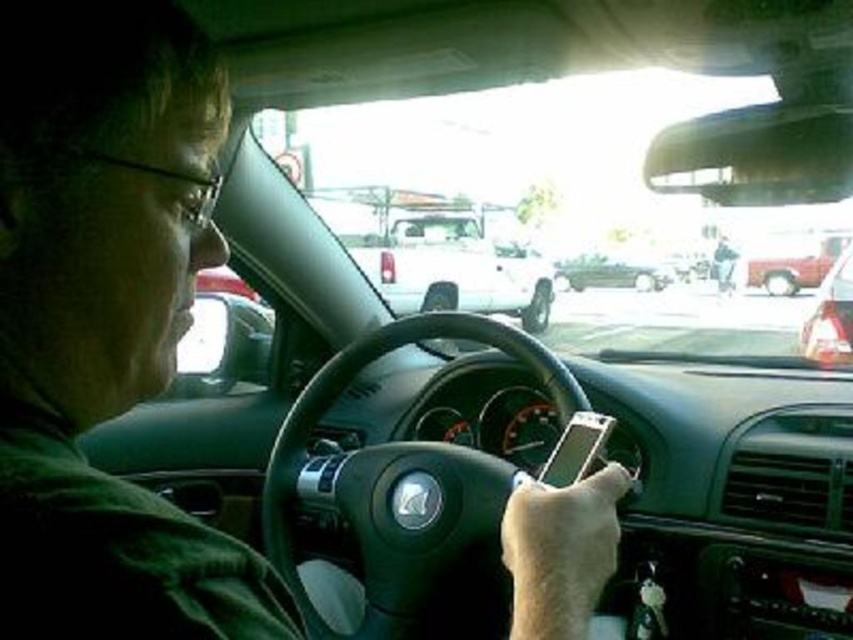
Between green matte shirt at center and shiny silver car at right, which one is positioned higher?

green matte shirt at center is higher up.

Is point (94, 83) farther from viewer compared to point (833, 353)?

No.

Between point (119, 77) and point (802, 342), which one is positioned behind?

The point (802, 342) is more distant.

This screenshot has height=640, width=853. Find the location of `green matte shirt at center`. green matte shirt at center is located at coordinates (106, 321).

Is point (26, 474) closer to camera compared to point (645, 268)?

Yes, it is.

How far apart are green matte shirt at center and shiny black sedan at center?

The distance of green matte shirt at center from shiny black sedan at center is 15.53 meters.

You are a GUI agent. You are given a task and a screenshot of the screen. Output one action in this format:
    pyautogui.click(x=<x>, y=<y>)
    Task: Click on the green matte shirt at center
    
    Given the screenshot: What is the action you would take?
    pyautogui.click(x=106, y=321)

Find the location of a particular element. This screenshot has width=853, height=640. green matte shirt at center is located at coordinates (106, 321).

Does point (790, 285) lie behind point (579, 262)?

No, (790, 285) is in front of (579, 262).

The height and width of the screenshot is (640, 853). What are the coordinates of `metallic red truck at right` in the screenshot? It's located at (795, 262).

This screenshot has width=853, height=640. I want to click on metallic red truck at right, so click(795, 262).